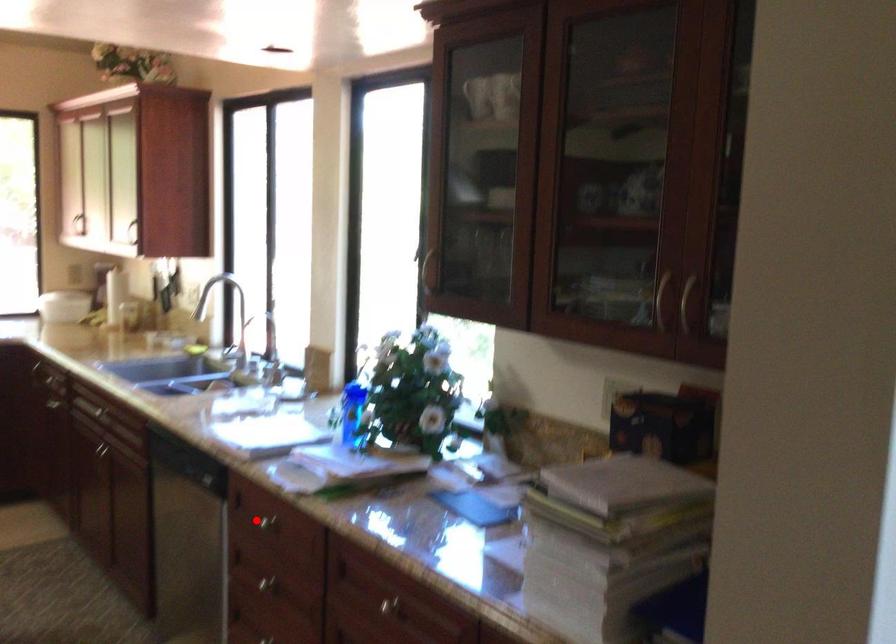
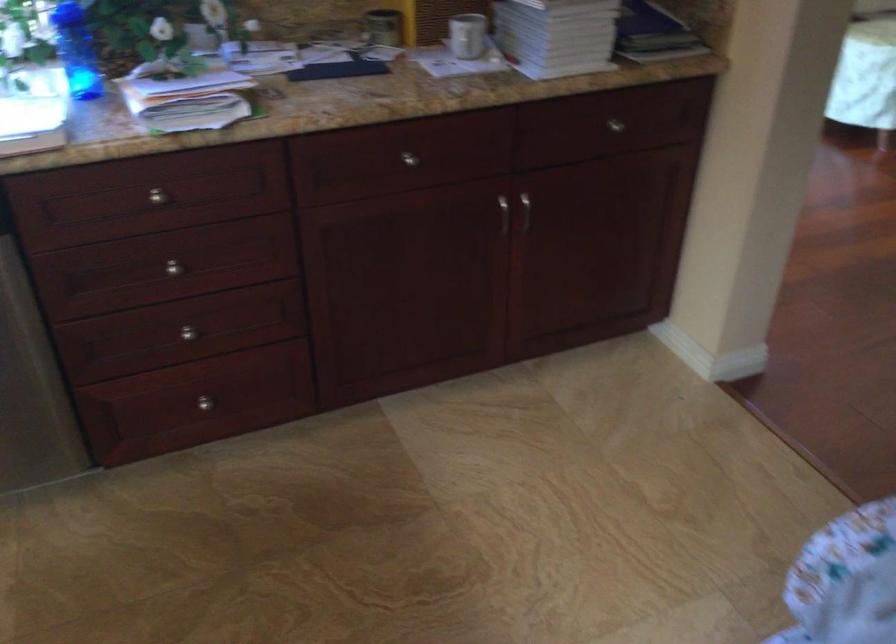
The point at the highlighted location is marked in the first image. Where is the corresponding point in the second image?

(156, 196)